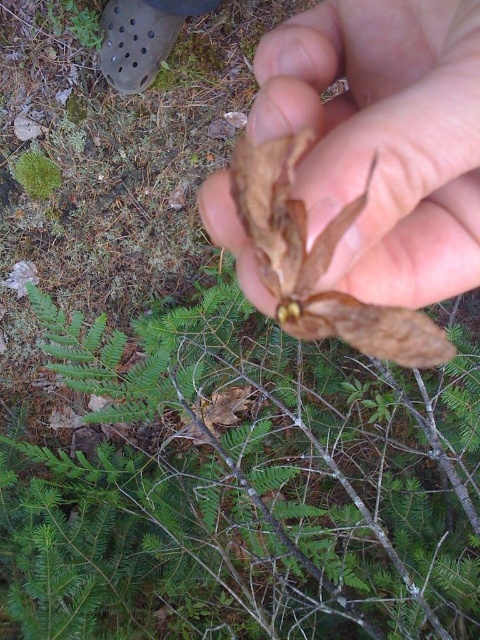
Question: Can you confirm if brown matte leaf at upper center is wider than green fuzzy moss at upper left?

Choices:
 (A) no
 (B) yes

Answer: (B)

Question: Is brown matte leaf at upper center wider than green fuzzy moss at upper left?

Choices:
 (A) no
 (B) yes

Answer: (B)

Question: Which point appears farthest from the camera in this image?

Choices:
 (A) (442, 160)
 (B) (14, 176)

Answer: (B)

Question: Which object is farther from the camera taking this photo?

Choices:
 (A) green fuzzy moss at upper left
 (B) brown matte leaf at upper center

Answer: (A)

Question: Is brown matte leaf at upper center to the right of green fuzzy moss at upper left from the viewer's perspective?

Choices:
 (A) no
 (B) yes

Answer: (B)